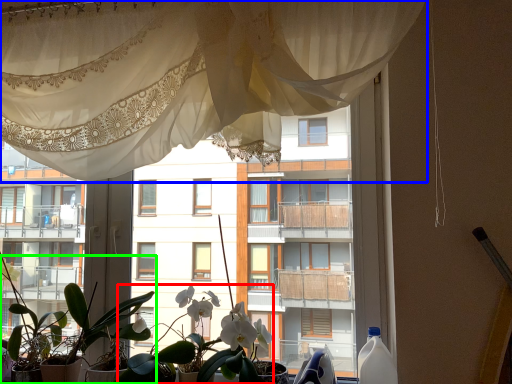
Question: Based on their relative distances, which object is farther from floral arrangement (highlighted by a red box)? Choose from curtain (highlighted by a blue box) and houseplant (highlighted by a green box).

Choices:
 (A) curtain
 (B) houseplant

Answer: (A)